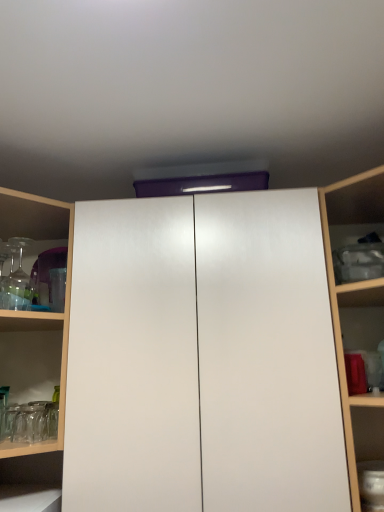
Question: Is clear glassware at left positioned beyond the bounds of white glossy cupboard at center?

Choices:
 (A) no
 (B) yes

Answer: (B)

Question: Is clear glassware at left further to the viewer compared to white glossy cupboard at center?

Choices:
 (A) no
 (B) yes

Answer: (B)

Question: Is clear glassware at left not near white glossy cupboard at center?

Choices:
 (A) yes
 (B) no

Answer: (B)

Question: Is clear glassware at left closer to the viewer compared to white glossy cupboard at center?

Choices:
 (A) no
 (B) yes

Answer: (A)

Question: Does clear glassware at left appear on the left side of white glossy cupboard at center?

Choices:
 (A) yes
 (B) no

Answer: (A)

Question: Are clear glassware at left and white glossy cupboard at center beside each other?

Choices:
 (A) yes
 (B) no

Answer: (B)

Question: From the image's perspective, is white glossy cupboard at center on top of clear glassware at left?

Choices:
 (A) no
 (B) yes

Answer: (A)

Question: From a real-world perspective, does white glossy cupboard at center sit lower than clear glassware at left?

Choices:
 (A) yes
 (B) no

Answer: (A)

Question: Is white glossy cupboard at center taller than clear glassware at left?

Choices:
 (A) yes
 (B) no

Answer: (A)

Question: Is white glossy cupboard at center oriented towards clear glassware at left?

Choices:
 (A) yes
 (B) no

Answer: (B)

Question: Would you say white glossy cupboard at center is outside clear glassware at left?

Choices:
 (A) no
 (B) yes

Answer: (B)

Question: Can you confirm if white glossy cupboard at center is shorter than clear glassware at left?

Choices:
 (A) yes
 (B) no

Answer: (B)

Question: From a real-world perspective, is clear glassware at left above or below white glossy cupboard at center?

Choices:
 (A) above
 (B) below

Answer: (A)